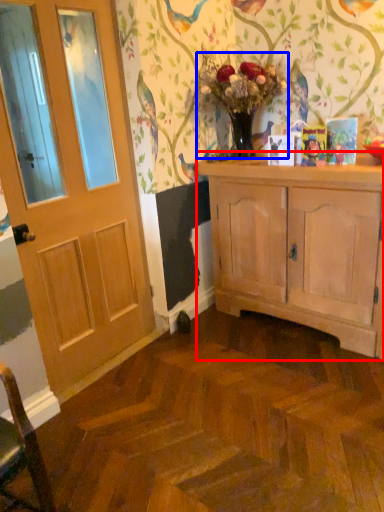
Question: Which object appears closest to the camera in this image, cabinetry (highlighted by a red box) or floral arrangement (highlighted by a blue box)?

Choices:
 (A) cabinetry
 (B) floral arrangement

Answer: (A)